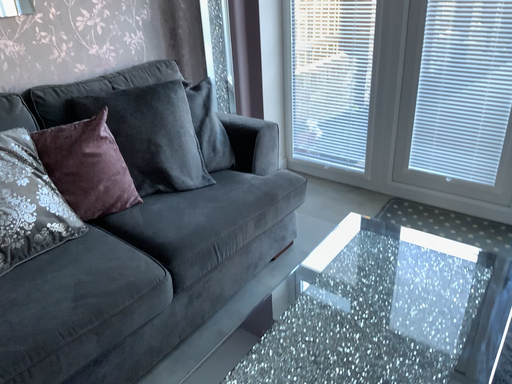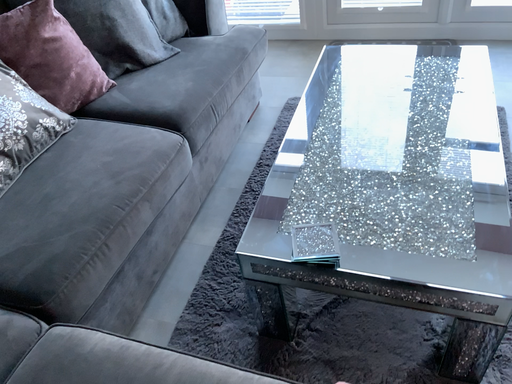
Question: Which way did the camera rotate in the video?

Choices:
 (A) rotated right
 (B) rotated left

Answer: (A)